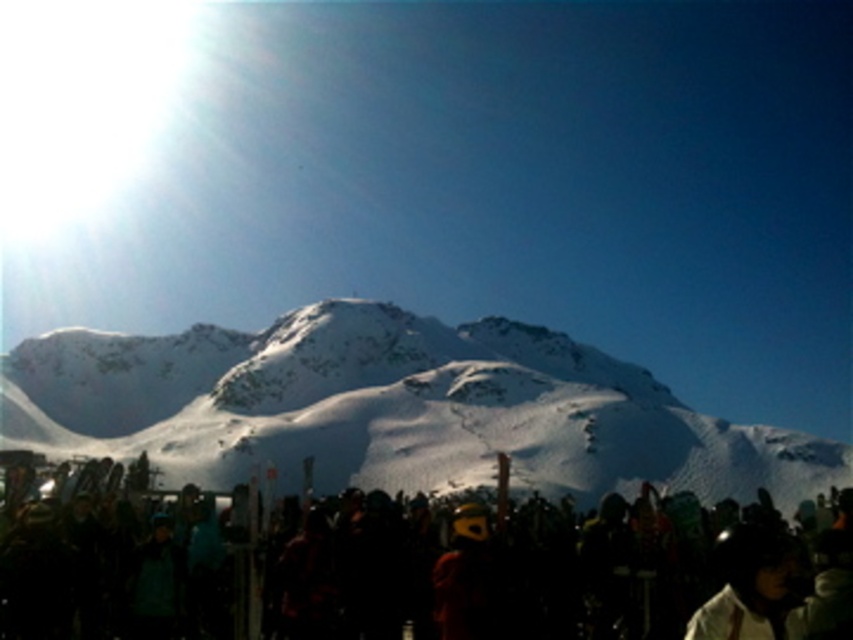
Is white snow-covered mountain at center to the left of black matte crowd at lower center from the viewer's perspective?

Correct, you'll find white snow-covered mountain at center to the left of black matte crowd at lower center.

Who is shorter, white snow-covered mountain at center or black matte crowd at lower center?

black matte crowd at lower center is shorter.

Which is in front, point (592, 458) or point (637, 637)?

Point (637, 637) is more forward.

Identify the location of white snow-covered mountain at center. The width and height of the screenshot is (853, 640). (392, 408).